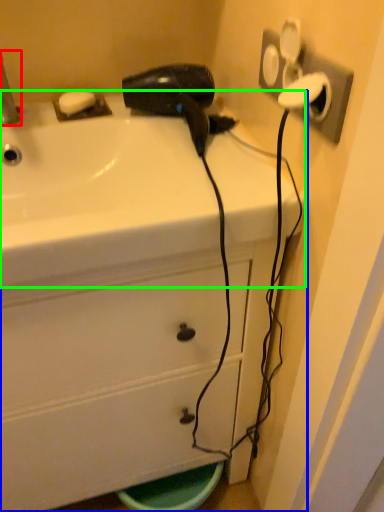
Question: Which object is the farthest from faucet (highlighted by a red box)? Choose among these: bathroom cabinet (highlighted by a blue box) or sink (highlighted by a green box).

Choices:
 (A) bathroom cabinet
 (B) sink

Answer: (A)